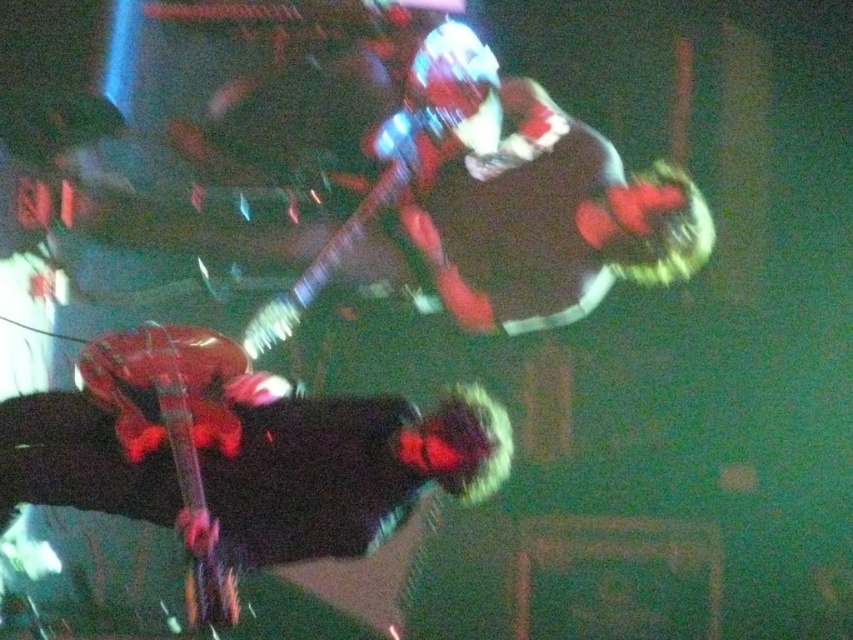
Which is more to the left, glossy red guitar at lower left or glossy electric guitar at upper center?

glossy red guitar at lower left

The height and width of the screenshot is (640, 853). In order to click on glossy red guitar at lower left in this screenshot , I will do `click(175, 433)`.

Does point (106, 465) come closer to viewer compared to point (218, 432)?

Yes, it is in front of point (218, 432).

Does shiny black guitar at lower left have a greater width compared to glossy red guitar at lower left?

Yes.

Who is more forward, [6,513] or [196,508]?

Point [196,508] is more forward.

The width and height of the screenshot is (853, 640). I want to click on shiny black guitar at lower left, so click(328, 458).

Does shiny black guitar at lower left appear on the left side of glossy electric guitar at upper center?

Yes, shiny black guitar at lower left is to the left of glossy electric guitar at upper center.

What do you see at coordinates (328, 458) in the screenshot? The height and width of the screenshot is (640, 853). I see `shiny black guitar at lower left` at bounding box center [328, 458].

What do you see at coordinates (328, 458) in the screenshot?
I see `shiny black guitar at lower left` at bounding box center [328, 458].

This screenshot has width=853, height=640. In order to click on shiny black guitar at lower left in this screenshot , I will do `click(328, 458)`.